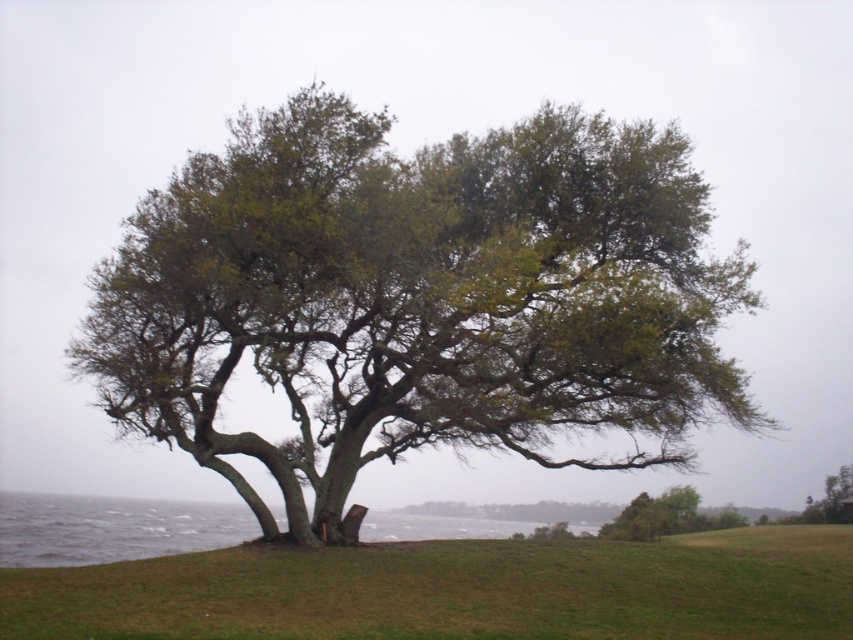
Does green grassy at lower center appear over green water at lower left?

Indeed, green grassy at lower center is positioned over green water at lower left.

Who is shorter, green grassy at lower center or green water at lower left?

green water at lower left

Which is in front, point (24, 637) or point (419, 531)?

Point (24, 637) is in front.

At what (x,y) coordinates should I click in order to perform the action: click on green grassy at lower center. Please return your answer as a coordinate pair (x, y). This screenshot has width=853, height=640. Looking at the image, I should click on (456, 589).

Which of these two, green leafy tree at center or green water at lower left, stands taller?

green leafy tree at center is taller.

Can you confirm if green leafy tree at center is positioned above green water at lower left?

Correct, green leafy tree at center is located above green water at lower left.

Who is more distant from viewer, (608, 170) or (10, 515)?

Point (10, 515)

I want to click on green leafy tree at center, so click(416, 298).

Which is in front, point (589, 460) or point (345, 632)?

Positioned in front is point (345, 632).

Which of these two, green leafy tree at center or green grassy at lower center, stands taller?

With more height is green leafy tree at center.

Does point (152, 323) come in front of point (851, 545)?

Yes, point (152, 323) is closer to viewer.

At what (x,y) coordinates should I click in order to perform the action: click on green leafy tree at center. Please return your answer as a coordinate pair (x, y). The height and width of the screenshot is (640, 853). Looking at the image, I should click on (416, 298).